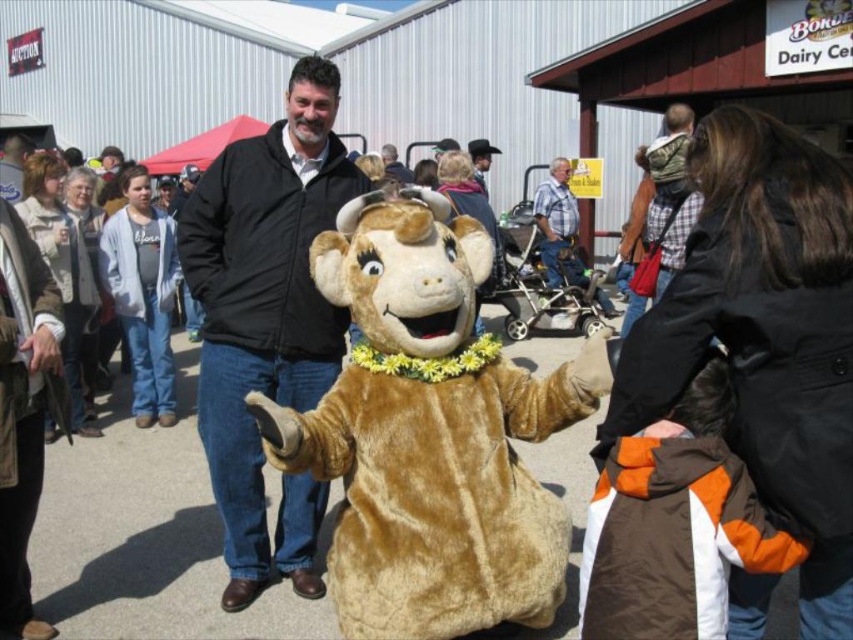
Looking at this image, can you confirm if fuzzy brown bear at center is positioned to the right of dark brown leather jacket at center?

Yes, fuzzy brown bear at center is to the right of dark brown leather jacket at center.

Which of these two, fuzzy brown bear at center or dark brown leather jacket at center, stands shorter?

With less height is dark brown leather jacket at center.

This screenshot has width=853, height=640. What are the coordinates of `fuzzy brown bear at center` in the screenshot? It's located at (430, 433).

Find the location of a particular element. This screenshot has width=853, height=640. fuzzy brown bear at center is located at coordinates (430, 433).

Between black softshell jacket at center and dark brown leather jacket at center, which one has more height?

With more height is black softshell jacket at center.

Between black softshell jacket at center and dark brown leather jacket at center, which one is positioned lower?

black softshell jacket at center is lower down.

You are a GUI agent. You are given a task and a screenshot of the screen. Output one action in this format:
    pyautogui.click(x=<x>, y=<y>)
    Task: Click on the black softshell jacket at center
    The width and height of the screenshot is (853, 640).
    Given the screenshot: What is the action you would take?
    pyautogui.click(x=267, y=320)

Is fuzzy brown bear at center to the left of blue plaid shirt at center from the viewer's perspective?

Correct, you'll find fuzzy brown bear at center to the left of blue plaid shirt at center.

Who is positioned more to the right, fuzzy brown bear at center or blue plaid shirt at center?

From the viewer's perspective, blue plaid shirt at center appears more on the right side.

Which is in front, point (483, 449) or point (564, 218)?

Point (483, 449) is in front.

Where is `fuzzy brown bear at center`? This screenshot has height=640, width=853. fuzzy brown bear at center is located at coordinates (430, 433).